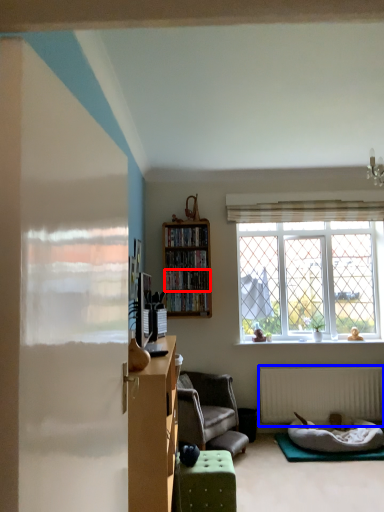
Question: Which object is further to the camera taking this photo, shelf (highlighted by a red box) or radiator (highlighted by a blue box)?

Choices:
 (A) shelf
 (B) radiator

Answer: (A)